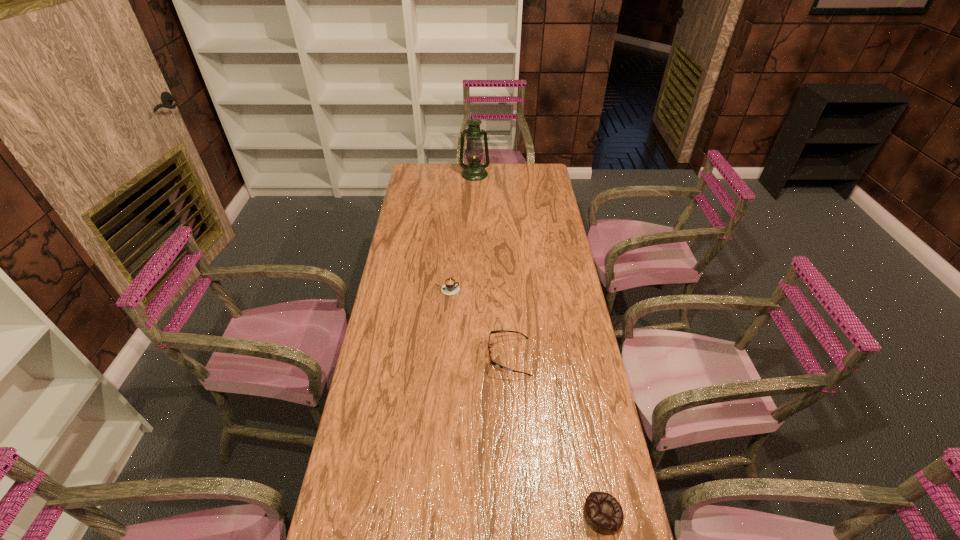
In order to click on free space located 0.200m on the front-facing side of the sunglasses in this screenshot , I will do `click(428, 357)`.

I want to click on blank space located on the left of the beanbag, so click(492, 514).

Find the location of a particular element. free space located with the handle on the side of the cappuccino is located at coordinates (515, 289).

What are the coordinates of `object that is at the far edge` in the screenshot? It's located at (473, 171).

At what (x,y) coordinates should I click in order to perform the action: click on object located in the right edge section of the desktop. Please return your answer as a coordinate pair (x, y). Image resolution: width=960 pixels, height=540 pixels. Looking at the image, I should click on (603, 513).

Where is `free space at the far edge`? The image size is (960, 540). free space at the far edge is located at coordinates (486, 180).

The height and width of the screenshot is (540, 960). In order to click on vacant space at the left edge in this screenshot , I will do `click(369, 430)`.

At what (x,y) coordinates should I click in order to perform the action: click on vacant space at the right edge of the desktop. Please return your answer as a coordinate pair (x, y). This screenshot has height=540, width=960. Looking at the image, I should click on (568, 285).

I want to click on free space between the farthest object and the beanbag, so click(x=539, y=344).

Where is `free space between the cappuccino and the tallest object`? The width and height of the screenshot is (960, 540). free space between the cappuccino and the tallest object is located at coordinates (461, 232).